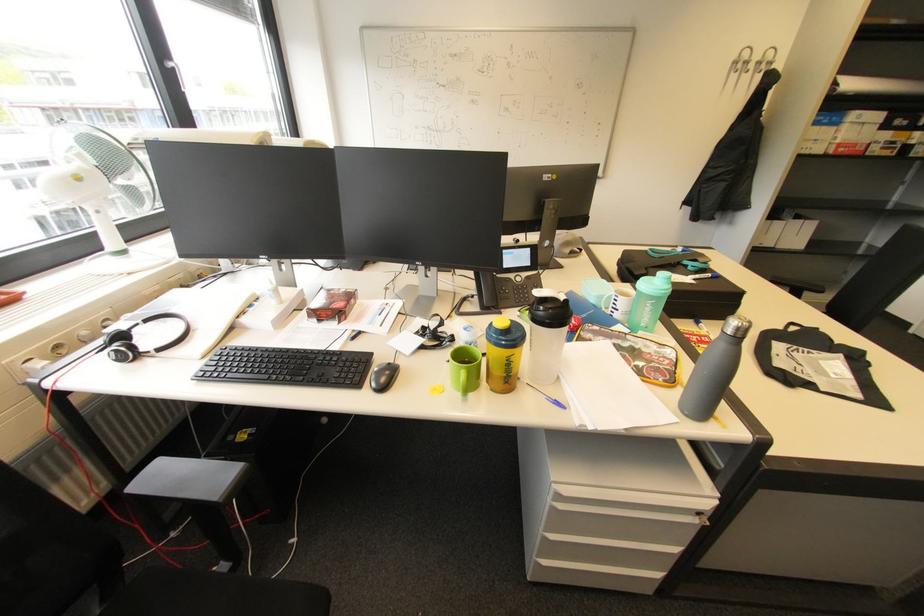
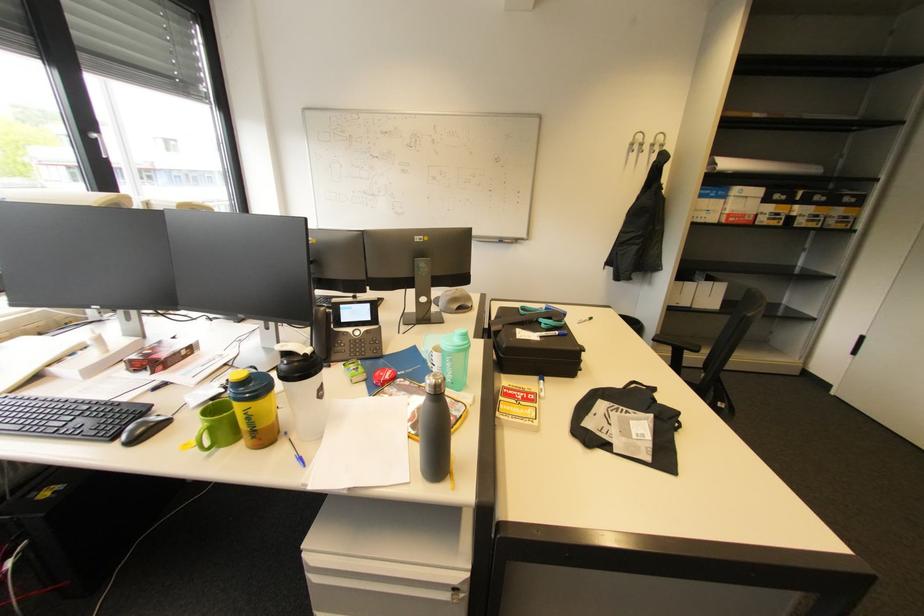
Question: What movement of the cameraman would produce the second image?

Choices:
 (A) Left
 (B) Right
 (C) Forward
 (D) Backward

Answer: (B)